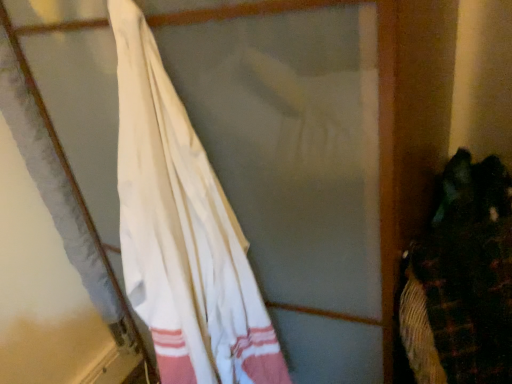
The image size is (512, 384). Identify the location of white cotton towel at left. tap(182, 231).

Measure the distance between white cotton towel at left and camera.

white cotton towel at left is 23.99 inches away from camera.

Image resolution: width=512 pixels, height=384 pixels. Describe the element at coordinates (182, 231) in the screenshot. I see `white cotton towel at left` at that location.

The image size is (512, 384). What do you see at coordinates (462, 280) in the screenshot?
I see `dark green fabric at right` at bounding box center [462, 280].

Locate an element on the screen. This screenshot has width=512, height=384. dark green fabric at right is located at coordinates (462, 280).

Locate an element on the screen. white cotton towel at left is located at coordinates (182, 231).

Can you confirm if dark green fabric at right is positioned to the right of white cotton towel at left?

Correct, you'll find dark green fabric at right to the right of white cotton towel at left.

Looking at this image, is the position of dark green fabric at right more distant than that of white cotton towel at left?

That is True.

Which point is more distant from viewer, [468,381] or [199,320]?

Point [199,320]

From the image's perspective, is dark green fabric at right positioned above or below white cotton towel at left?

dark green fabric at right is below white cotton towel at left.

From a real-world perspective, is dark green fabric at right on top of white cotton towel at left?

Incorrect, from a real-world perspective, dark green fabric at right is lower than white cotton towel at left.

Considering the sizes of dark green fabric at right and white cotton towel at left in the image, is dark green fabric at right wider or thinner than white cotton towel at left?

Considering their sizes, dark green fabric at right looks broader than white cotton towel at left.

Between dark green fabric at right and white cotton towel at left, which one has more height?

Standing taller between the two is white cotton towel at left.

Considering the relative sizes of dark green fabric at right and white cotton towel at left in the image provided, is dark green fabric at right bigger than white cotton towel at left?

Actually, dark green fabric at right might be smaller than white cotton towel at left.

Is white cotton towel at left completely or partially inside dark green fabric at right?

Actually, white cotton towel at left is outside dark green fabric at right.

Are dark green fabric at right and white cotton towel at left beside each other?

No, dark green fabric at right is not touching white cotton towel at left.

Could you tell me if dark green fabric at right is turned towards white cotton towel at left?

No.

What's the angular difference between dark green fabric at right and white cotton towel at left's facing directions?

46.1 degrees separate the facing orientations of dark green fabric at right and white cotton towel at left.

Identify the location of laundry below the white cotton towel at left (from the image's perspective). This screenshot has width=512, height=384. (462, 280).

Is white cotton towel at left at the right side of dark green fabric at right?

No, white cotton towel at left is not to the right of dark green fabric at right.

Considering the relative positions of white cotton towel at left and dark green fabric at right in the image provided, is white cotton towel at left in front of dark green fabric at right?

Yes, white cotton towel at left is closer to the camera.

Is point (166, 299) more distant than point (458, 291)?

Yes, it is behind point (458, 291).

From the image's perspective, which one is positioned lower, white cotton towel at left or dark green fabric at right?

From the image's view, dark green fabric at right is below.

From a real-world perspective, is white cotton towel at left physically above dark green fabric at right?

Yes, from a real-world perspective, white cotton towel at left is on top of dark green fabric at right.

In terms of width, does white cotton towel at left look wider or thinner when compared to dark green fabric at right?

Considering their sizes, white cotton towel at left looks slimmer than dark green fabric at right.

Can you confirm if white cotton towel at left is shorter than dark green fabric at right?

Incorrect, the height of white cotton towel at left does not fall short of that of dark green fabric at right.

Does white cotton towel at left have a larger size compared to dark green fabric at right?

Indeed, white cotton towel at left has a larger size compared to dark green fabric at right.

Does white cotton towel at left contain dark green fabric at right?

No, dark green fabric at right is not a part of white cotton towel at left.

Would you say white cotton towel at left is a long distance from dark green fabric at right?

No, white cotton towel at left is not far from dark green fabric at right.

Is white cotton towel at left facing towards dark green fabric at right?

No, white cotton towel at left is not turned towards dark green fabric at right.

How many degrees apart are the facing directions of white cotton towel at left and dark green fabric at right?

The angle between the facing direction of white cotton towel at left and the facing direction of dark green fabric at right is 46.1 degrees.

Locate an element on the screen. curtain above the dark green fabric at right (from a real-world perspective) is located at coordinates (182, 231).

I want to click on curtain lying in front of the dark green fabric at right, so click(x=182, y=231).

You are a GUI agent. You are given a task and a screenshot of the screen. Output one action in this format:
    pyautogui.click(x=<x>, y=<y>)
    Task: Click on the curtain above the dark green fabric at right (from a real-world perspective)
    This screenshot has height=384, width=512.
    Given the screenshot: What is the action you would take?
    pyautogui.click(x=182, y=231)